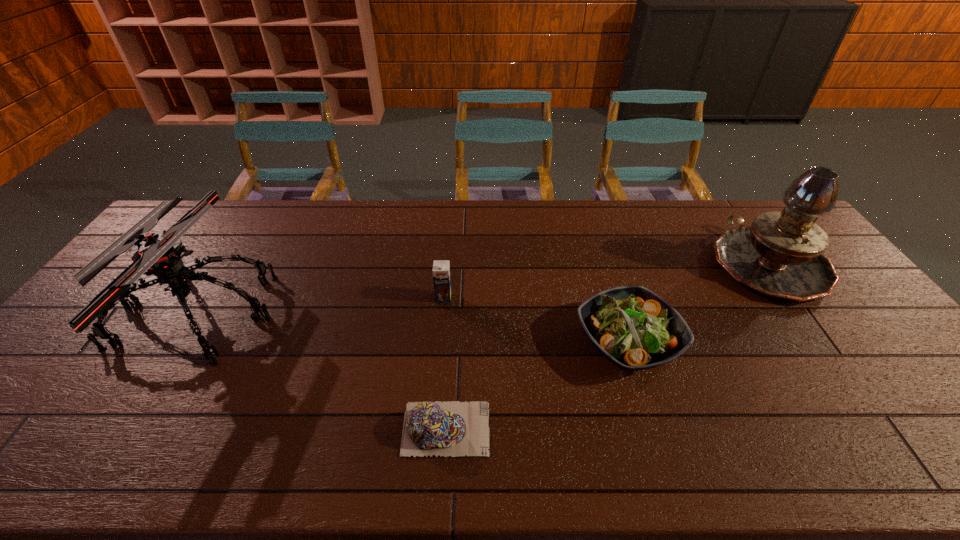
You are a GUI agent. You are given a task and a screenshot of the screen. Output one action in this format:
    pyautogui.click(x=<x>, y=<y>)
    Task: Click on the object that stands as the closest to the nearest object
    The height and width of the screenshot is (540, 960).
    Given the screenshot: What is the action you would take?
    pyautogui.click(x=635, y=329)

Find the location of a particular element. The image size is (960, 540). free spot that satisfies the following two spatial constraints: 1. on the front label of the third tallest object; 2. on the right side of the salad plate is located at coordinates point(440,342).

Locate an element on the screen. The height and width of the screenshot is (540, 960). free region that satisfies the following two spatial constraints: 1. on the front label of the second shortest object; 2. on the left side of the chocolate milk is located at coordinates (x=440, y=342).

The width and height of the screenshot is (960, 540). I want to click on free spot that satisfies the following two spatial constraints: 1. on the back side of the drone; 2. on the left side of the tallest object, so click(226, 264).